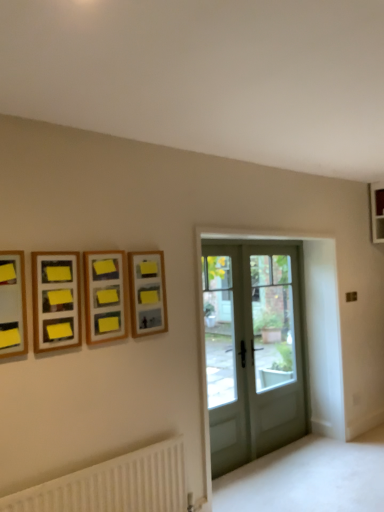
Question: Can you confirm if clear glass door at center, the second screen door when ordered from right to left, is positioned to the left of wooden frame at upper center, which is the 1th picture frame from back to front?

Choices:
 (A) no
 (B) yes

Answer: (A)

Question: Does clear glass door at center, the 1th screen door when ordered from left to right, have a greater height compared to wooden frame at upper center, which ranks as the fourth picture frame in front-to-back order?

Choices:
 (A) no
 (B) yes

Answer: (B)

Question: Is clear glass door at center, the second screen door when ordered from right to left, further to camera compared to wooden frame at upper center, which ranks as the fourth picture frame in front-to-back order?

Choices:
 (A) yes
 (B) no

Answer: (A)

Question: Does clear glass door at center, the second screen door when ordered from right to left, have a larger size compared to wooden frame at upper center, the 1th picture frame when ordered from right to left?

Choices:
 (A) yes
 (B) no

Answer: (A)

Question: Is clear glass door at center, the second screen door when ordered from right to left, closer to the viewer compared to wooden frame at upper center, which is the 1th picture frame from back to front?

Choices:
 (A) no
 (B) yes

Answer: (A)

Question: Does clear glass door at center, the 2th screen door when ordered from back to front, have a lesser width compared to wooden frame at upper center, which is the 1th picture frame from back to front?

Choices:
 (A) yes
 (B) no

Answer: (B)

Question: Does matte glass door at center have a greater width compared to wooden frame at upper center, which ranks as the fourth picture frame in front-to-back order?

Choices:
 (A) yes
 (B) no

Answer: (B)

Question: Is matte glass door at center located outside wooden frame at upper center, which ranks as the fourth picture frame in front-to-back order?

Choices:
 (A) yes
 (B) no

Answer: (A)

Question: From the image's perspective, would you say matte glass door at center is shown under wooden frame at upper center, which is the 1th picture frame from back to front?

Choices:
 (A) yes
 (B) no

Answer: (A)

Question: Considering the relative sizes of matte glass door at center and wooden frame at upper center, which is the 1th picture frame from back to front, in the image provided, is matte glass door at center taller than wooden frame at upper center, which is the 1th picture frame from back to front,?

Choices:
 (A) no
 (B) yes

Answer: (B)

Question: Is matte glass door at center positioned before wooden frame at upper center, which ranks as the fourth picture frame in front-to-back order?

Choices:
 (A) no
 (B) yes

Answer: (A)

Question: Are matte glass door at center and wooden frame at upper center, which ranks as the fourth picture frame in front-to-back order, far apart?

Choices:
 (A) no
 (B) yes

Answer: (B)

Question: Is wooden picture frame at left, the 1th picture frame when ordered from left to right, facing towards clear glass door at center, the second screen door when ordered from right to left?

Choices:
 (A) no
 (B) yes

Answer: (A)